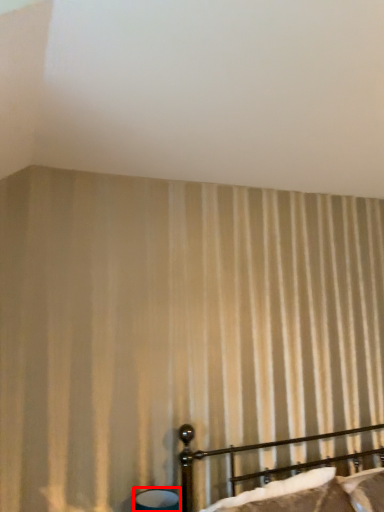
Question: Considering the relative positions of table lamp (annotated by the red box) and bed in the image provided, where is table lamp (annotated by the red box) located with respect to the staircase?

Choices:
 (A) left
 (B) right

Answer: (A)